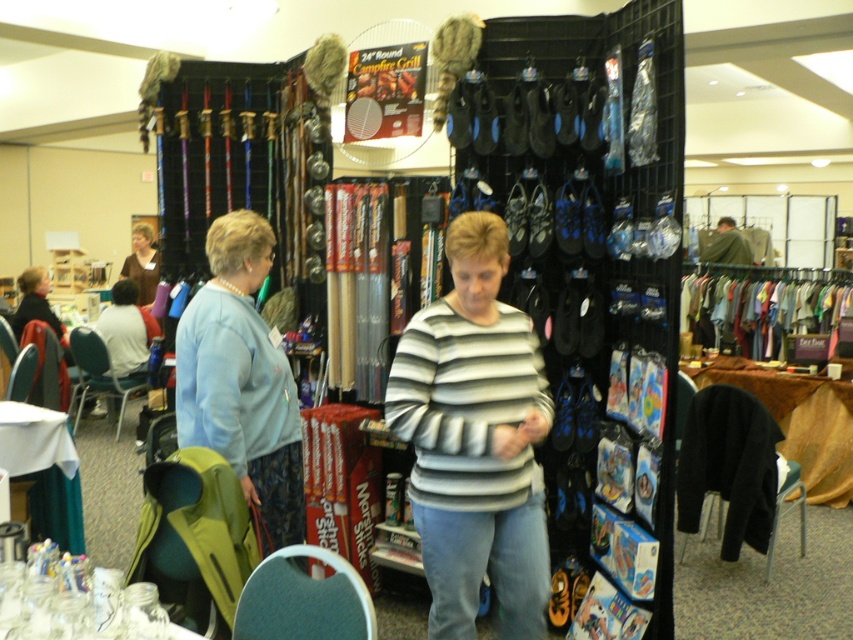
Question: Among these points, which one is nearest to the camera?

Choices:
 (A) (144, 336)
 (B) (253, 257)
 (C) (717, 253)

Answer: (B)

Question: Can you confirm if striped cotton sweater at center is smaller than light blue sweater at center?

Choices:
 (A) yes
 (B) no

Answer: (B)

Question: Is white cotton shirt at left below green fabric jacket at center?

Choices:
 (A) no
 (B) yes

Answer: (B)

Question: Is light blue sweater at center smaller than green fabric jacket at center?

Choices:
 (A) no
 (B) yes

Answer: (A)

Question: Considering the real-world distances, which object is closest to the striped cotton sweater at center?

Choices:
 (A) light blue sweater at center
 (B) green fabric jacket at center
 (C) white cotton shirt at left

Answer: (A)

Question: Estimate the real-world distances between objects in this image. Which object is farther from the green fabric jacket at center?

Choices:
 (A) striped cotton sweater at center
 (B) light blue sweater at center

Answer: (B)